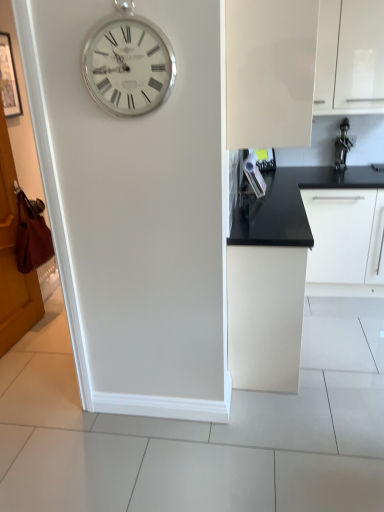
Question: Does white glossy cabinet at upper right, which is the first cabinetry in top-to-bottom order, lie in front of glossy white cabinet at upper right, which ranks as the 2th cabinetry in top-to-bottom order?

Choices:
 (A) no
 (B) yes

Answer: (A)

Question: Is white glossy cabinet at upper right, the third cabinetry from the bottom, with glossy white cabinet at upper right, which ranks as the 2th cabinetry in top-to-bottom order?

Choices:
 (A) yes
 (B) no

Answer: (B)

Question: Is glossy white cabinet at upper right, which ranks as the 2th cabinetry in top-to-bottom order, a part of white glossy cabinet at upper right, which is the first cabinetry in top-to-bottom order?

Choices:
 (A) yes
 (B) no

Answer: (B)

Question: Is white glossy cabinet at upper right, which is the first cabinetry in top-to-bottom order, to the left of glossy white cabinet at upper right, which ranks as the 2th cabinetry in top-to-bottom order, from the viewer's perspective?

Choices:
 (A) yes
 (B) no

Answer: (B)

Question: From a real-world perspective, is white glossy cabinet at upper right, the third cabinetry from the bottom, on top of glossy white cabinet at upper right, which ranks as the 2th cabinetry in top-to-bottom order?

Choices:
 (A) no
 (B) yes

Answer: (A)

Question: Would you say matte white cabinet at center, the third cabinetry from the top, is to the left or to the right of silver metallic clock at upper left in the picture?

Choices:
 (A) right
 (B) left

Answer: (A)

Question: Considering their positions, is matte white cabinet at center, the third cabinetry from the top, located in front of or behind silver metallic clock at upper left?

Choices:
 (A) behind
 (B) front

Answer: (A)

Question: Considering the positions of point (233, 281) and point (94, 77), is point (233, 281) closer or farther from the camera than point (94, 77)?

Choices:
 (A) closer
 (B) farther

Answer: (B)

Question: Considering the positions of matte white cabinet at center, the third cabinetry from the top, and silver metallic clock at upper left in the image, is matte white cabinet at center, the third cabinetry from the top, taller or shorter than silver metallic clock at upper left?

Choices:
 (A) tall
 (B) short

Answer: (A)

Question: Is glossy white cabinet at upper right, which ranks as the 2th cabinetry in top-to-bottom order, in front of or behind white glossy cabinet at upper right, which is the first cabinetry in top-to-bottom order, in the image?

Choices:
 (A) front
 (B) behind

Answer: (A)

Question: Looking at the image, does glossy white cabinet at upper right, which ranks as the 2th cabinetry in top-to-bottom order, seem bigger or smaller compared to white glossy cabinet at upper right, which is the first cabinetry in top-to-bottom order?

Choices:
 (A) big
 (B) small

Answer: (A)

Question: Is glossy white cabinet at upper right, which ranks as the 2th cabinetry in top-to-bottom order, to the left or to the right of white glossy cabinet at upper right, which is the first cabinetry in top-to-bottom order, in the image?

Choices:
 (A) right
 (B) left

Answer: (B)

Question: From the image's perspective, is glossy white cabinet at upper right, which ranks as the 2th cabinetry in top-to-bottom order, positioned above or below white glossy cabinet at upper right, which is the first cabinetry in top-to-bottom order?

Choices:
 (A) above
 (B) below

Answer: (B)

Question: Visually, is white glossy cabinet at upper right, which is the first cabinetry in top-to-bottom order, positioned to the left or to the right of silver metallic clock at upper left?

Choices:
 (A) left
 (B) right

Answer: (B)

Question: Relative to silver metallic clock at upper left, is white glossy cabinet at upper right, the third cabinetry from the bottom, in front or behind?

Choices:
 (A) behind
 (B) front

Answer: (A)